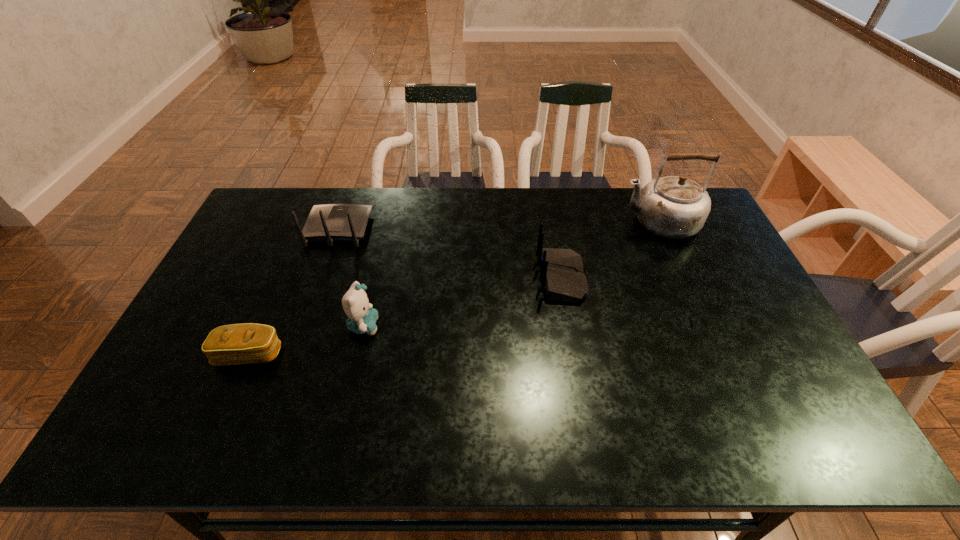
At what (x,y) coordinates should I click in order to perform the action: click on vacant region between the tallest object and the shortest object. Please return your answer as a coordinate pair (x, y). Image resolution: width=960 pixels, height=540 pixels. Looking at the image, I should click on (454, 288).

Where is `free space between the rightmost object and the kitten`? The height and width of the screenshot is (540, 960). free space between the rightmost object and the kitten is located at coordinates (512, 274).

This screenshot has height=540, width=960. What are the coordinates of `free area in between the nearer router and the clutch bag` in the screenshot? It's located at (405, 316).

At what (x,y) coordinates should I click in order to perform the action: click on unoccupied area between the kitten and the right router. Please return your answer as a coordinate pair (x, y). Looking at the image, I should click on (463, 302).

Find the location of a particular element. vacant point located between the kitten and the nearer router is located at coordinates (463, 302).

Identify the location of vacant area between the right router and the shortest object. (405, 316).

At what (x,y) coordinates should I click in order to perform the action: click on empty space between the kitten and the tallest object. Please return your answer as a coordinate pair (x, y). The height and width of the screenshot is (540, 960). Looking at the image, I should click on (512, 274).

Identify the location of the fourth closest object relative to the third object from left to right. The width and height of the screenshot is (960, 540). (675, 207).

Find the location of a particular element. The width and height of the screenshot is (960, 540). the fourth closest object relative to the farther router is located at coordinates (675, 207).

This screenshot has width=960, height=540. Find the location of `free space that satisfies the following two spatial constraints: 1. on the face of the third object from left to right; 2. on the zipper side of the shortest object`. free space that satisfies the following two spatial constraints: 1. on the face of the third object from left to right; 2. on the zipper side of the shortest object is located at coordinates (357, 354).